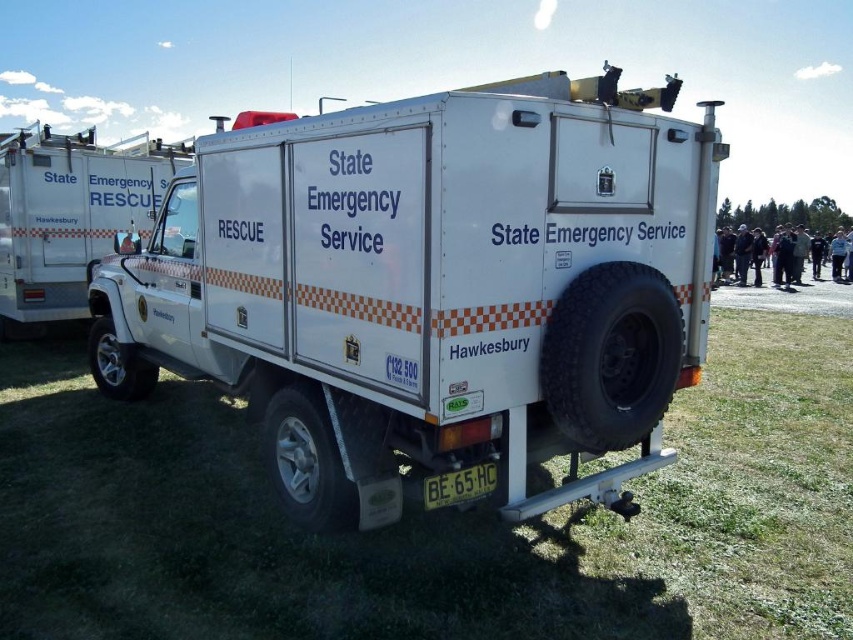
You are a photographer trying to capture both the white matte rescue vehicle at center and the green grass at lower center in a single frame. Based on their sizes, which object will appear larger in your photo?

The green grass at lower center will appear larger in the photo since the white matte rescue vehicle at center has a smaller size compared to it.

You are a photographer standing at a safe distance from the white matte rescue vehicle at center. You need to capture a clear photo of the license plate BE65HC on the vehicle. Considering the distance between you and the vehicle, would you need a telephoto lens to get a closeup of the license plate?

The distance between you and the white matte rescue vehicle at center is 2.98 meters. A telephoto lens is typically used for capturing distant subjects, but since you are only 2.98 meters away, a standard lens should suffice to capture the license plate clearly without needing a telephoto lens.